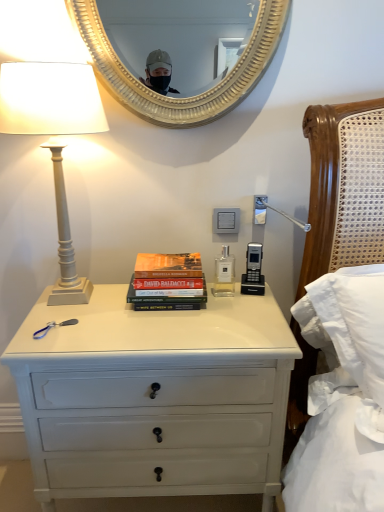
This screenshot has width=384, height=512. Describe the element at coordinates (50, 99) in the screenshot. I see `white matte column lamp at left` at that location.

This screenshot has width=384, height=512. Describe the element at coordinates (154, 397) in the screenshot. I see `white painted wood chest of drawers at center` at that location.

Measure the distance between point [140,297] and camera.

A distance of 1.25 meters exists between point [140,297] and camera.

This screenshot has width=384, height=512. I want to click on white matte column lamp at left, so click(50, 99).

Between white matte column lamp at left and hardcover books at center, which one appears on the right side from the viewer's perspective?

hardcover books at center.

Does white matte column lamp at left have a greater height compared to hardcover books at center?

Yes, white matte column lamp at left is taller than hardcover books at center.

Could you tell me if white matte column lamp at left is facing hardcover books at center?

No, white matte column lamp at left is not turned towards hardcover books at center.

Is white plastic power outlet at center wider than white painted wood chest of drawers at center?

In fact, white plastic power outlet at center might be narrower than white painted wood chest of drawers at center.

Would you say white plastic power outlet at center is inside or outside white painted wood chest of drawers at center?

white plastic power outlet at center is located beyond the bounds of white painted wood chest of drawers at center.

From a real-world perspective, between white painted wood chest of drawers at center and white plastic power outlet at center, who is vertically lower?

From a 3D spatial view, white painted wood chest of drawers at center is below.

Does white painted wood chest of drawers at center touch white plastic power outlet at center?

No, white painted wood chest of drawers at center is not with white plastic power outlet at center.

Is point (190, 492) closer to camera compared to point (224, 228)?

That is True.

Looking at this image, which object is positioned more to the right, white painted wood chest of drawers at center or white plastic power outlet at center?

From the viewer's perspective, white plastic power outlet at center appears more on the right side.

Which object is wider, gold textured mirror at upper center or white matte column lamp at left?

white matte column lamp at left.

Is gold textured mirror at upper center bigger or smaller than white matte column lamp at left?

In the image, gold textured mirror at upper center appears to be smaller than white matte column lamp at left.

Consider the image. From the image's perspective, is gold textured mirror at upper center under white matte column lamp at left?

Incorrect, from the image's perspective, gold textured mirror at upper center is higher than white matte column lamp at left.

Could you tell me if gold textured mirror at upper center is facing white matte column lamp at left?

No.

Which object is wider, white plastic power outlet at center or white matte column lamp at left?

white matte column lamp at left.

From a real-world perspective, which object stands above the other?

white matte column lamp at left.

Who is shorter, white plastic power outlet at center or white matte column lamp at left?

white plastic power outlet at center is shorter.

Identify the location of lamp above the white plastic power outlet at center (from the image's perspective). (50, 99).

Considering the relative positions of gold textured mirror at upper center and white painted wood chest of drawers at center in the image provided, is gold textured mirror at upper center to the left or to the right of white painted wood chest of drawers at center?

Clearly, gold textured mirror at upper center is on the right of white painted wood chest of drawers at center in the image.

Are gold textured mirror at upper center and white painted wood chest of drawers at center located far from each other?

gold textured mirror at upper center is far away from white painted wood chest of drawers at center.

Is gold textured mirror at upper center located outside white painted wood chest of drawers at center?

Yes.

Can you tell me how much gold textured mirror at upper center and white painted wood chest of drawers at center differ in facing direction?

0.567 degrees.

Is point (230, 232) farther from viewer compared to point (201, 292)?

Yes, it is.

Is white plastic power outlet at center thinner than hardcover books at center?

Indeed, white plastic power outlet at center has a lesser width compared to hardcover books at center.

From their relative heights in the image, would you say white plastic power outlet at center is taller or shorter than hardcover books at center?

Considering their sizes, white plastic power outlet at center has less height than hardcover books at center.

Is the position of white plastic power outlet at center more distant than that of hardcover books at center?

That is True.

Image resolution: width=384 pixels, height=512 pixels. Find the location of `lamp above the hardcover books at center (from a real-world perspective)`. lamp above the hardcover books at center (from a real-world perspective) is located at coordinates (50, 99).

I want to click on chest of drawers lying on the left of white plastic power outlet at center, so click(x=154, y=397).

Estimate the real-world distances between objects in this image. Which object is further from hardcover books at center, white matte column lamp at left or white plastic power outlet at center?

white matte column lamp at left is positioned further to the anchor hardcover books at center.

Looking at the image, which one is located closer to white painted wood chest of drawers at center, gold textured mirror at upper center or hardcover books at center?

hardcover books at center lies closer to white painted wood chest of drawers at center than the other object.

Estimate the real-world distances between objects in this image. Which object is further from white painted wood chest of drawers at center, white matte column lamp at left or white plastic power outlet at center?

The object further to white painted wood chest of drawers at center is white plastic power outlet at center.

Based on their spatial positions, is hardcover books at center or white matte column lamp at left closer to white painted wood chest of drawers at center?

hardcover books at center is positioned closer to the anchor white painted wood chest of drawers at center.

From the image, which object appears to be nearer to white plastic power outlet at center, hardcover books at center or white painted wood chest of drawers at center?

hardcover books at center is closer to white plastic power outlet at center.

Estimate the real-world distances between objects in this image. Which object is closer to gold textured mirror at upper center, white plastic power outlet at center or white matte column lamp at left?

Among the two, white matte column lamp at left is located nearer to gold textured mirror at upper center.

Looking at the image, which one is located further to white matte column lamp at left, gold textured mirror at upper center or white plastic power outlet at center?

gold textured mirror at upper center is positioned further to the anchor white matte column lamp at left.

Considering their positions, is hardcover books at center positioned closer to white painted wood chest of drawers at center than gold textured mirror at upper center?

hardcover books at center.

The image size is (384, 512). In order to click on book that lies between white plastic power outlet at center and white painted wood chest of drawers at center from top to bottom in this screenshot , I will do `click(168, 282)`.

The width and height of the screenshot is (384, 512). What are the coordinates of `book between white matte column lamp at left and white plastic power outlet at center in the horizontal direction` in the screenshot? It's located at (168, 282).

The width and height of the screenshot is (384, 512). Find the location of `mirror between white matte column lamp at left and white plastic power outlet at center from left to right`. mirror between white matte column lamp at left and white plastic power outlet at center from left to right is located at coordinates (179, 40).

Where is `power outlet that lies between gold textured mirror at upper center and white painted wood chest of drawers at center from top to bottom`? power outlet that lies between gold textured mirror at upper center and white painted wood chest of drawers at center from top to bottom is located at coordinates (226, 220).